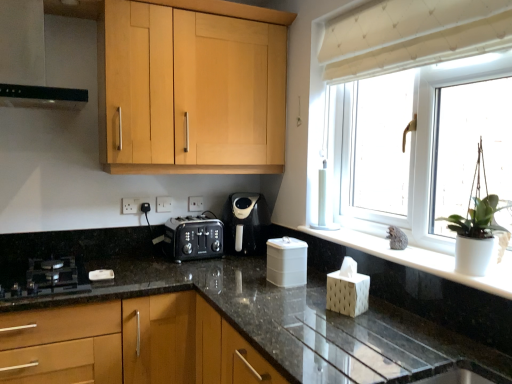
Question: Is black matte exhaust hood at upper left not close to white plastic electric outlet at center, the first electric outlet viewed from the back?

Choices:
 (A) yes
 (B) no

Answer: (A)

Question: From a real-world perspective, is black matte exhaust hood at upper left on white plastic electric outlet at center, the second electric outlet viewed from the front?

Choices:
 (A) no
 (B) yes

Answer: (B)

Question: Considering the relative sizes of black matte exhaust hood at upper left and white plastic electric outlet at center, the second electric outlet viewed from the front, in the image provided, is black matte exhaust hood at upper left smaller than white plastic electric outlet at center, the second electric outlet viewed from the front,?

Choices:
 (A) no
 (B) yes

Answer: (A)

Question: Is black matte exhaust hood at upper left outside of white plastic electric outlet at center, the first electric outlet viewed from the back?

Choices:
 (A) no
 (B) yes

Answer: (B)

Question: Is black matte exhaust hood at upper left at the left side of white plastic electric outlet at center, the first electric outlet from the right?

Choices:
 (A) no
 (B) yes

Answer: (B)

Question: From a real-world perspective, relative to black glass gas stove at lower left, is black plastic coffee maker at center vertically above or below?

Choices:
 (A) above
 (B) below

Answer: (A)

Question: Considering the positions of black plastic coffee maker at center and black glass gas stove at lower left in the image, is black plastic coffee maker at center bigger or smaller than black glass gas stove at lower left?

Choices:
 (A) small
 (B) big

Answer: (B)

Question: Is point (259, 208) closer or farther from the camera than point (67, 284)?

Choices:
 (A) closer
 (B) farther

Answer: (B)

Question: In the image, is black plastic coffee maker at center on the left side or the right side of black glass gas stove at lower left?

Choices:
 (A) left
 (B) right

Answer: (B)

Question: Is beige fabric curtain at upper right wider or thinner than white matte window sill at center?

Choices:
 (A) thin
 (B) wide

Answer: (B)

Question: Considering the positions of point (373, 64) and point (410, 263), is point (373, 64) closer or farther from the camera than point (410, 263)?

Choices:
 (A) closer
 (B) farther

Answer: (B)

Question: From a real-world perspective, is beige fabric curtain at upper right above or below white matte window sill at center?

Choices:
 (A) below
 (B) above

Answer: (B)

Question: Choose the correct answer: Is beige fabric curtain at upper right inside white matte window sill at center or outside it?

Choices:
 (A) outside
 (B) inside

Answer: (A)

Question: Would you say matte black toaster at center, acting as the first cabinetry starting from the bottom, is to the left or to the right of light wood cabinet at upper center, which is the first cabinetry in top-to-bottom order, in the picture?

Choices:
 (A) right
 (B) left

Answer: (B)

Question: Do you think matte black toaster at center, which is the 2th cabinetry from top to bottom, is within light wood cabinet at upper center, which is counted as the second cabinetry, starting from the bottom, or outside of it?

Choices:
 (A) outside
 (B) inside

Answer: (A)